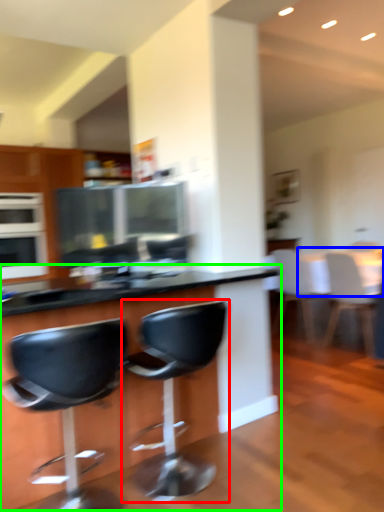
Question: Considering the real-world distances, which object is closest to chair (highlighted by a red box)? table (highlighted by a blue box) or table (highlighted by a green box).

Choices:
 (A) table
 (B) table

Answer: (B)